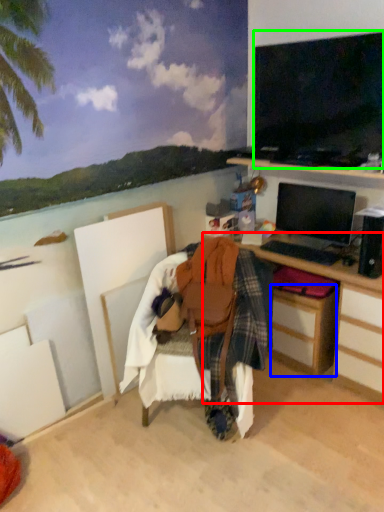
Question: Which object is the closest to the desk (highlighted by a red box)? Choose among these: drawer (highlighted by a blue box) or television (highlighted by a green box).

Choices:
 (A) drawer
 (B) television

Answer: (A)